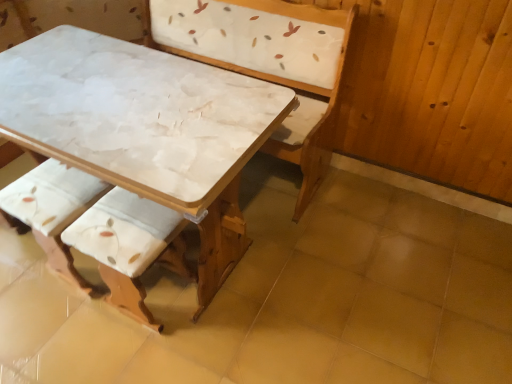
Where is `vacant space situated above white fabric cushion at lower left, the 2th armchair positioned from the left (from a real-world perspective)`? vacant space situated above white fabric cushion at lower left, the 2th armchair positioned from the left (from a real-world perspective) is located at coordinates (116, 228).